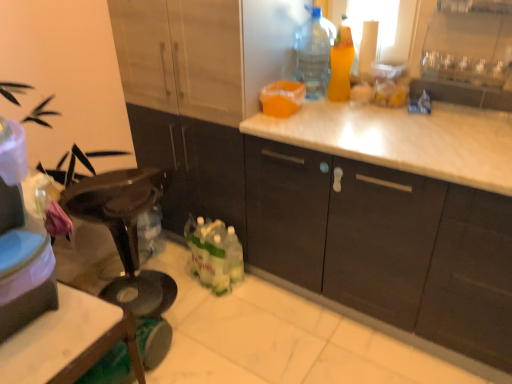
This screenshot has height=384, width=512. Identify the location of free point to the left of translucent orange spray bottle at upper right, marked as the second bottle in a left-to-right arrangement. (317, 103).